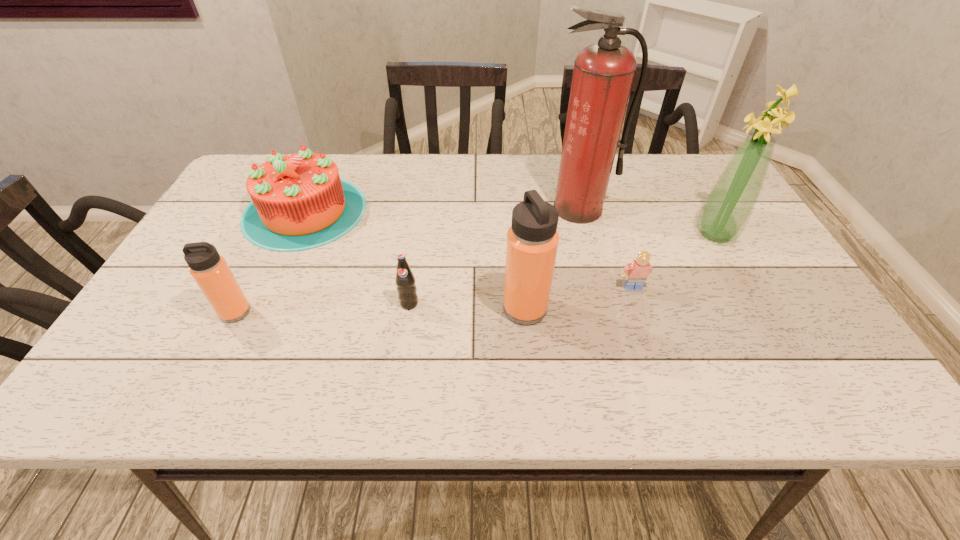
Locate an element on the screen. Image resolution: width=960 pixels, height=540 pixels. the left thermos bottle is located at coordinates (210, 271).

Locate an element on the screen. The height and width of the screenshot is (540, 960). the fourth object from right to left is located at coordinates (532, 240).

Where is `the fifth shortest object`? The width and height of the screenshot is (960, 540). the fifth shortest object is located at coordinates (532, 240).

The height and width of the screenshot is (540, 960). What are the coordinates of `the second tallest object` in the screenshot? It's located at (729, 206).

Where is `bouquet`? bouquet is located at coordinates (729, 206).

The height and width of the screenshot is (540, 960). In order to click on cake in this screenshot , I will do `click(299, 202)`.

Where is `Lego`? The image size is (960, 540). Lego is located at coordinates (636, 273).

The width and height of the screenshot is (960, 540). Identify the location of the shortest object. (636, 273).

Where is `the tallest object`? The height and width of the screenshot is (540, 960). the tallest object is located at coordinates (603, 74).

Find the location of a particular element. the fifth object from right to left is located at coordinates (407, 291).